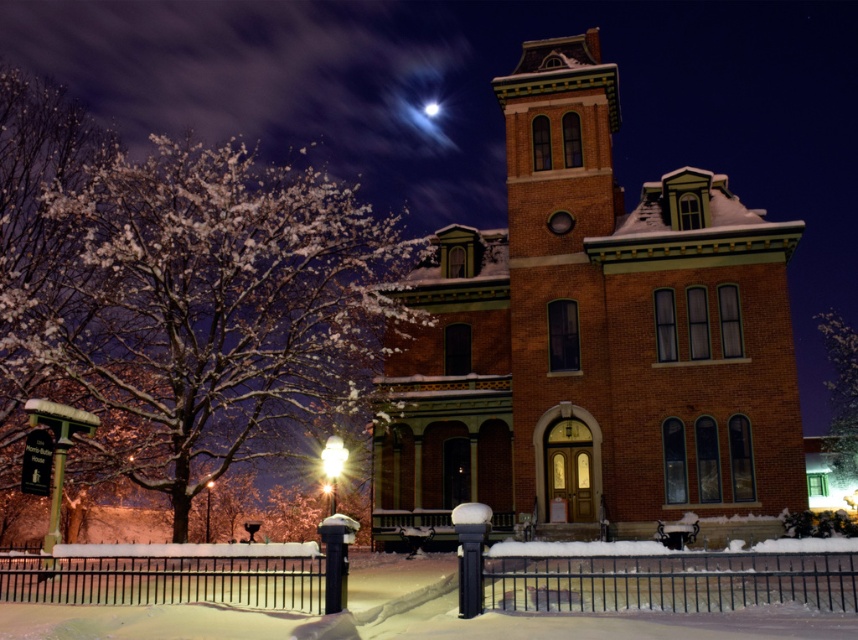
Based on the photo, you are standing at the center of the image. Which direction should you move to get closer to the brick building at center?

Since the brick building at center is already at the center of the image, you don not need to move in any direction to get closer. You are already facing the brick building at center.